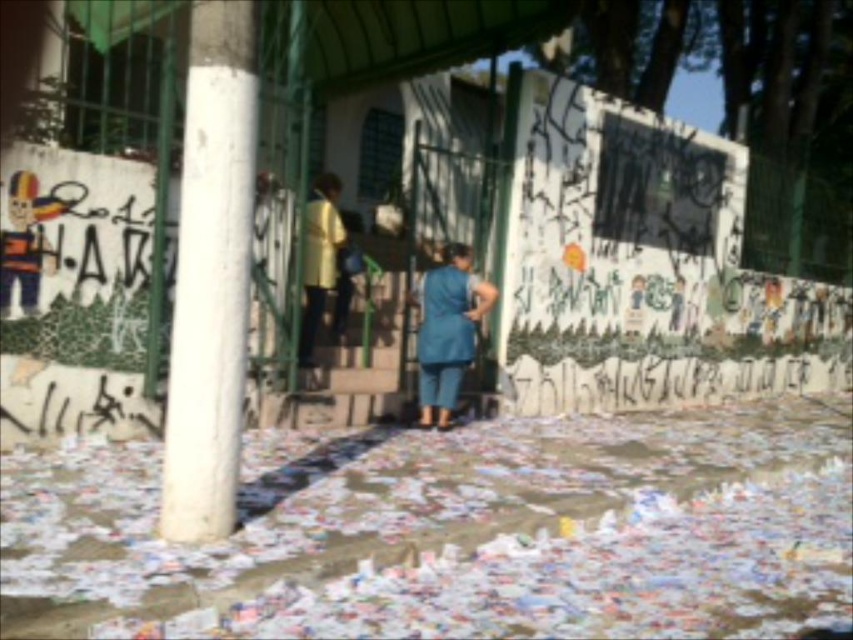
You are organizing a photoshoot and need to position the blue fabric dress at center and the yellow matte shirt at center in a way that accommodates their sizes. Which clothing item should be placed closer to the camera to ensure both are visible without overlapping?

The blue fabric dress at center is wider than the yellow matte shirt at center, so placing the wider blue fabric dress at center further back and the narrower yellow matte shirt at center closer to the camera would help prevent overlap while ensuring visibility.

You are standing at the entrance of the building and want to move to the white concrete pillar at left. What are the coordinates of the pillar to guide your path?

The white concrete pillar at left is located at coordinates 0.430 on the x axis and 0.249 on the y axis.